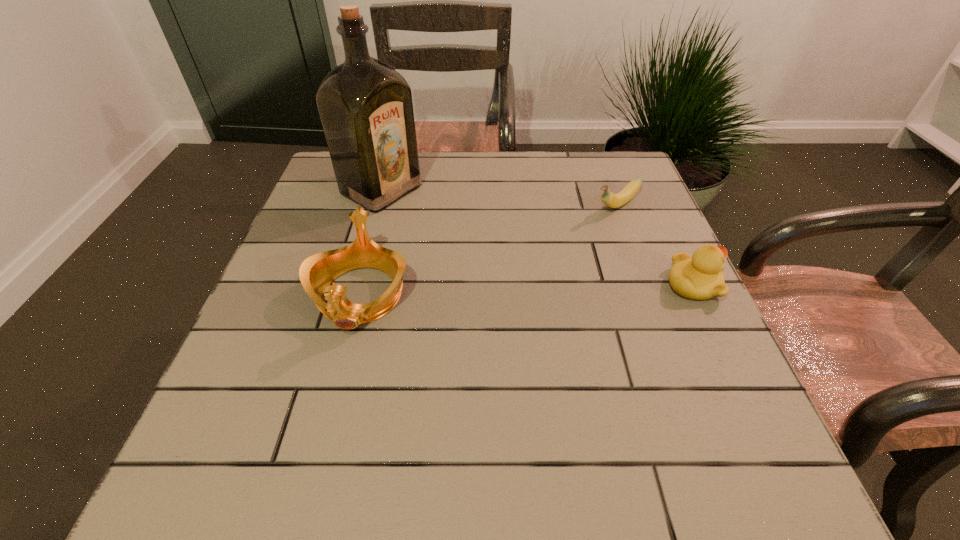
The image size is (960, 540). In order to click on vacant space on the desktop that is between the tiara and the duckling and is positioned at the stem of the banana in this screenshot , I will do `click(492, 291)`.

Find the location of a particular element. Image resolution: width=960 pixels, height=540 pixels. vacant spot on the desktop that is between the second tallest object and the duckling and is positioned on the label of the tallest object is located at coordinates (566, 289).